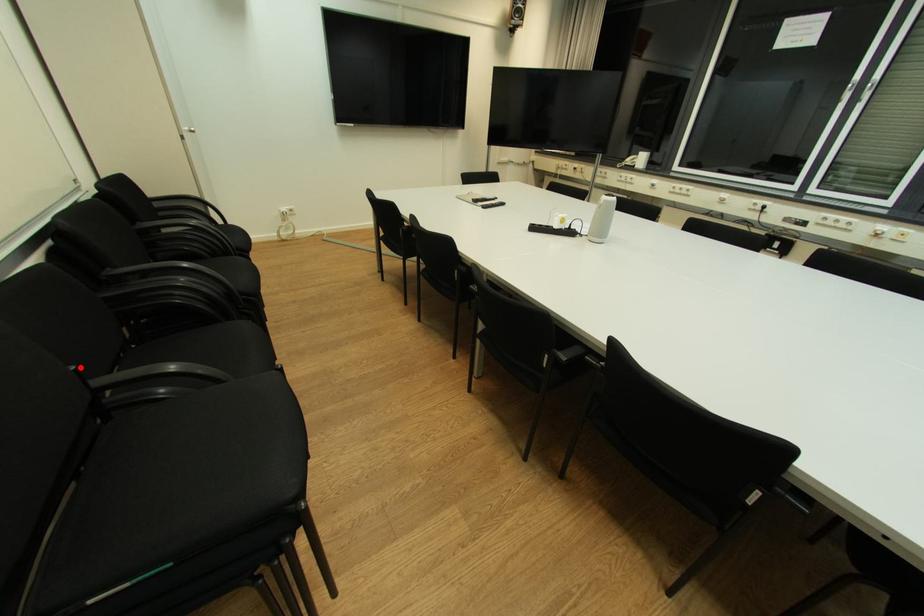
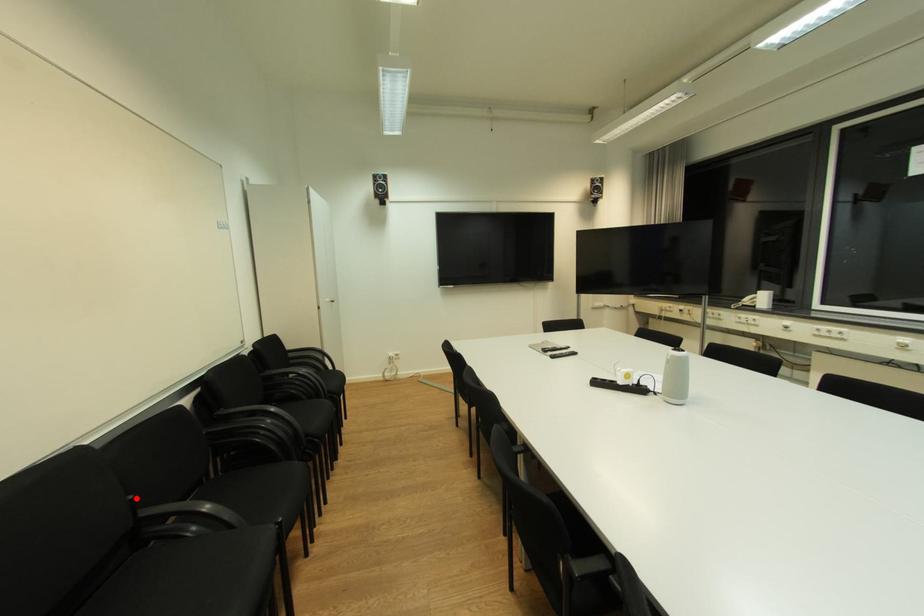
I am providing you with two images of the same scene from different viewpoints. A red point is marked on the first image and another point is marked on the second image. Are the points marked in image1 and image2 representing the same 3D position?

Yes